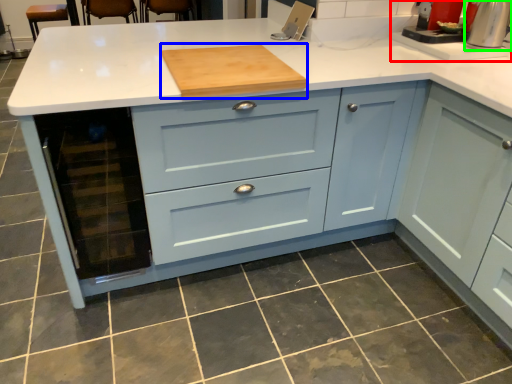
Question: Considering the real-world distances, which object is farthest from sink (highlighted by a red box)? kitchen appliance (highlighted by a blue box) or home appliance (highlighted by a green box)?

Choices:
 (A) kitchen appliance
 (B) home appliance

Answer: (A)